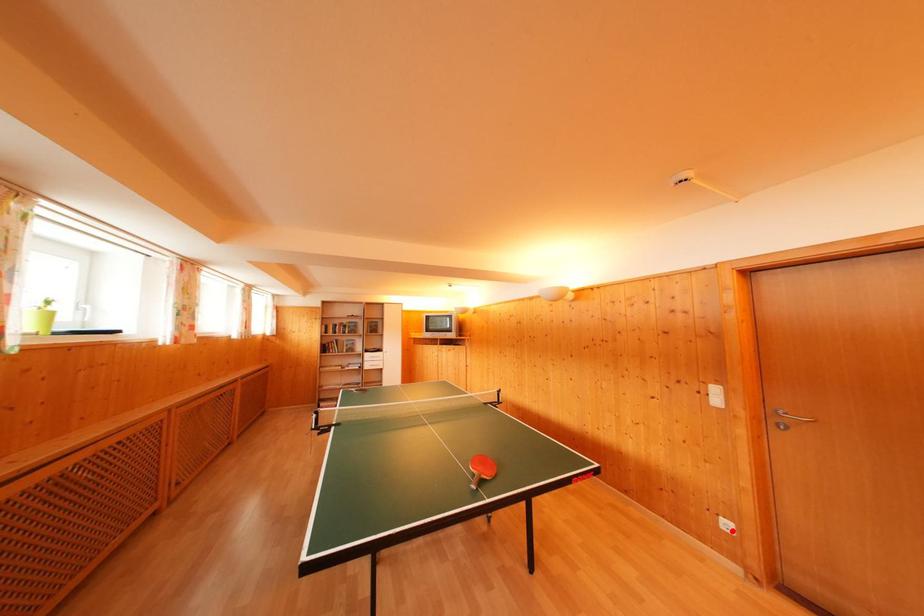
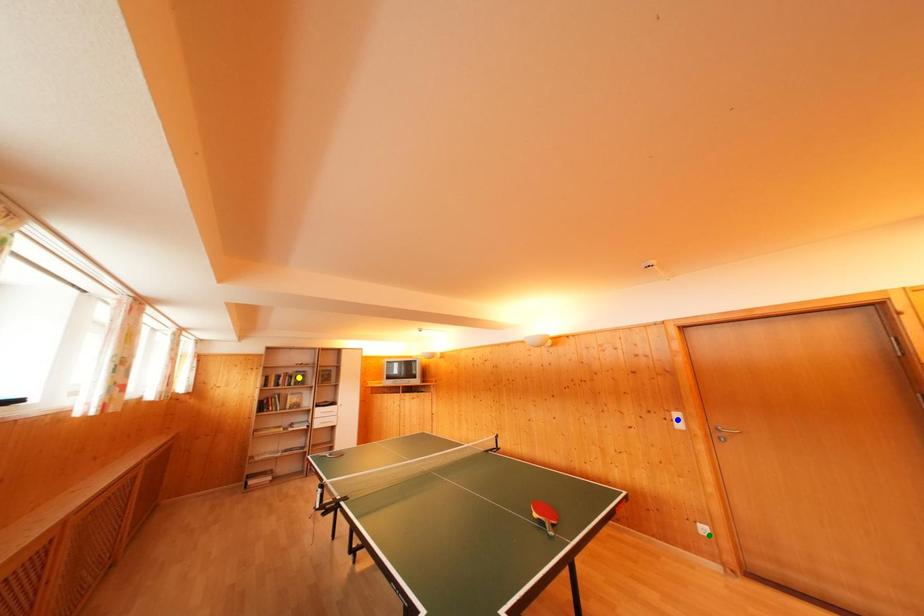
Question: I am providing you with two images of the same scene from different viewpoints. A red point is marked on the first image. You are given multiple points on the second image. Which mark in image 2 goes with the point in image 1?

Choices:
 (A) blue point
 (B) yellow point
 (C) green point

Answer: (C)